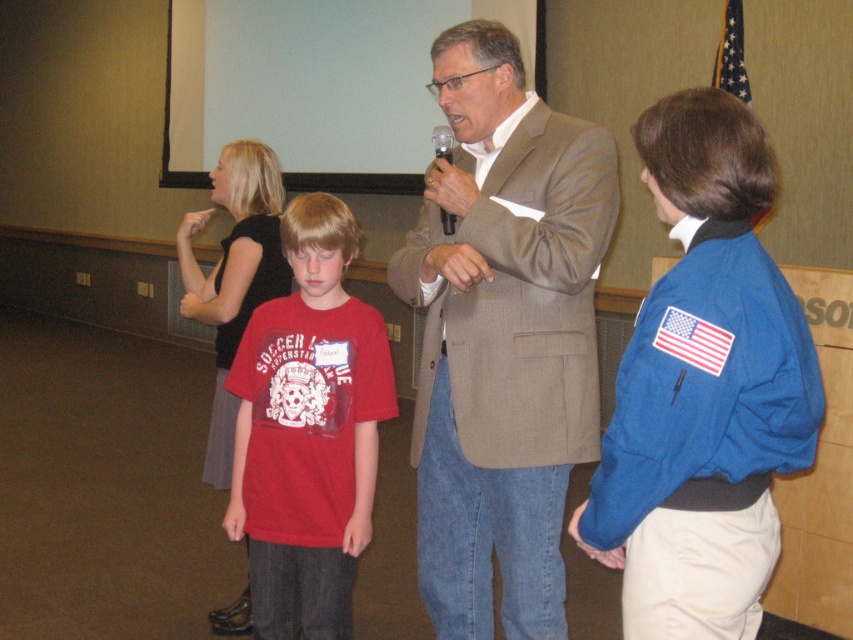
Question: Among these points, which one is nearest to the camera?

Choices:
 (A) (318, 260)
 (B) (450, 230)

Answer: (B)

Question: Where is matte red t-shirt at center located in relation to black plastic microphone at center in the image?

Choices:
 (A) right
 (B) left

Answer: (B)

Question: Does light brown textured suit at center have a greater width compared to black plastic microphone at center?

Choices:
 (A) no
 (B) yes

Answer: (B)

Question: Does matte red t-shirt at center have a greater width compared to black plastic microphone at center?

Choices:
 (A) yes
 (B) no

Answer: (A)

Question: Which point appears farthest from the camera in this image?

Choices:
 (A) (450, 268)
 (B) (434, 148)
 (C) (294, 417)

Answer: (C)

Question: Which object is farther from the camera taking this photo?

Choices:
 (A) matte red t-shirt at center
 (B) black plastic microphone at center

Answer: (A)